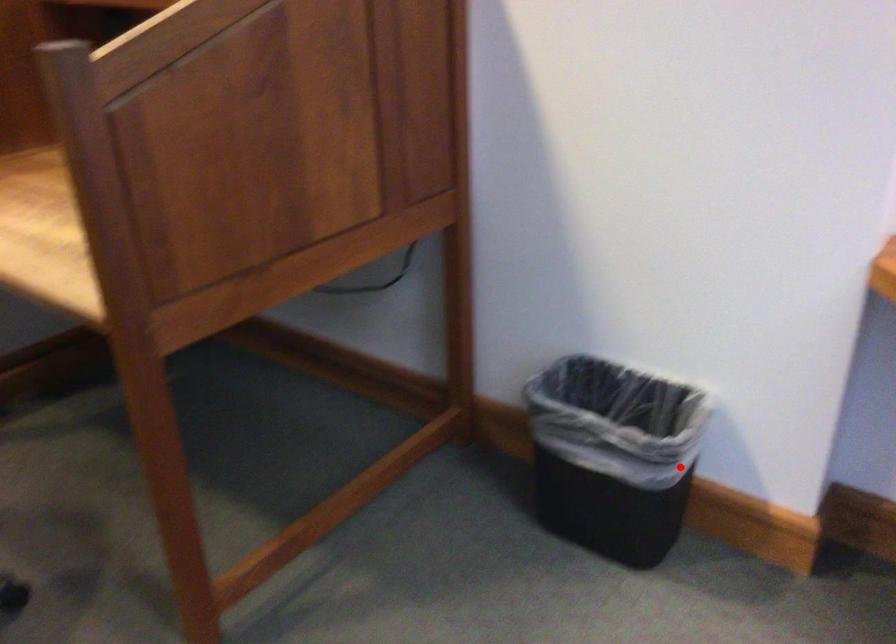
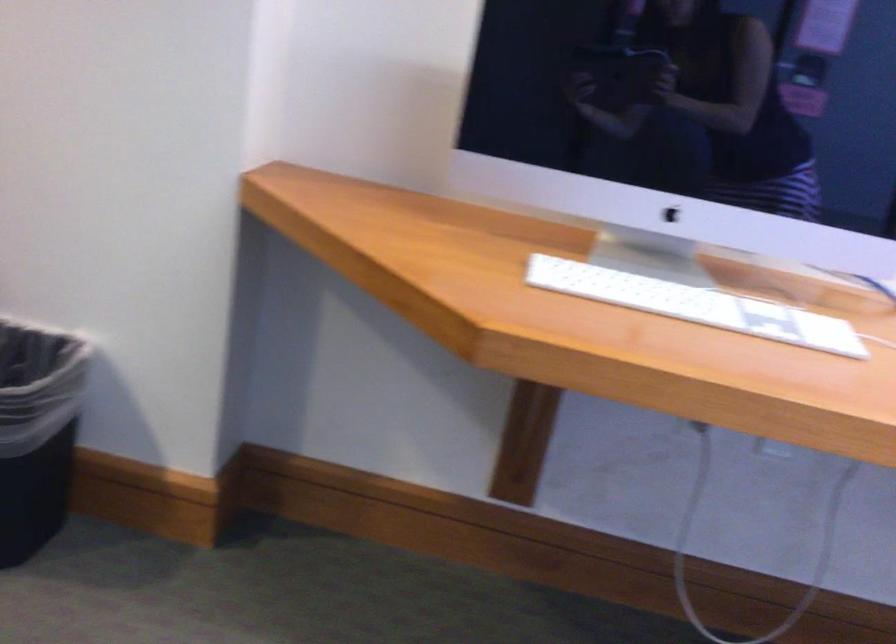
Question: A red point is marked in image1. In image2, is the corresponding 3D point closer to the camera or farther? Reply with the corresponding letter.

Choices:
 (A) The corresponding 3D point is closer.
 (B) The corresponding 3D point is farther.

Answer: (A)